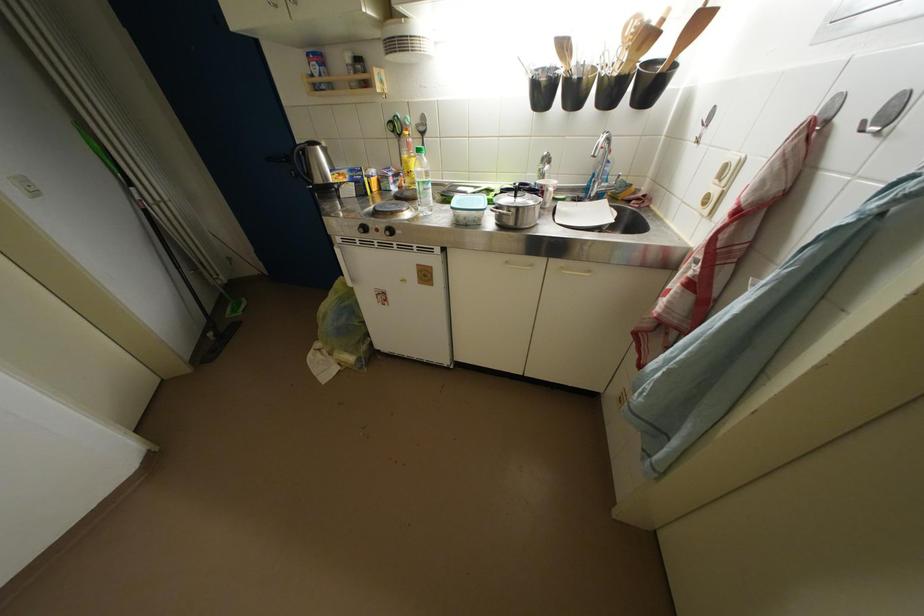
The image size is (924, 616). Find the location of `silver electric kettle`. silver electric kettle is located at coordinates (314, 167).